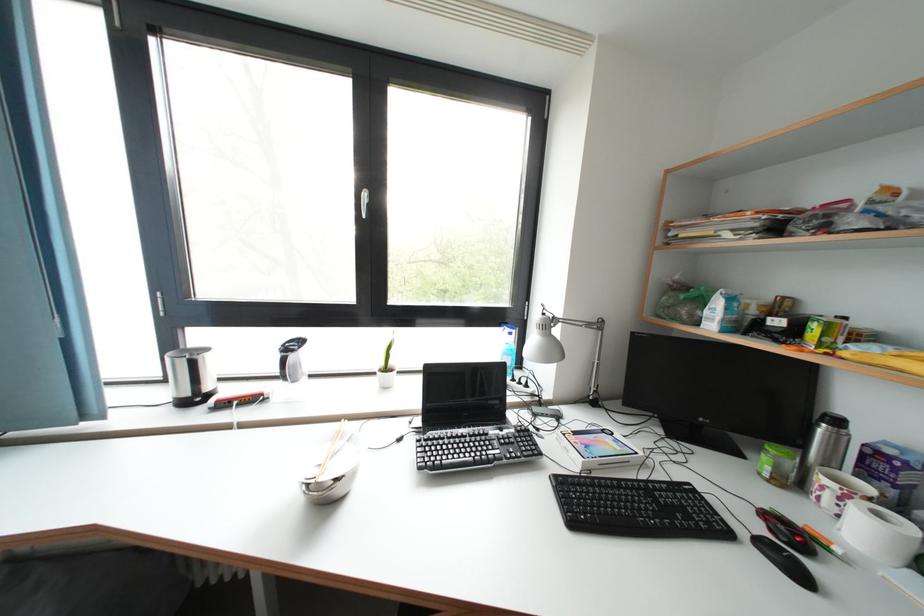
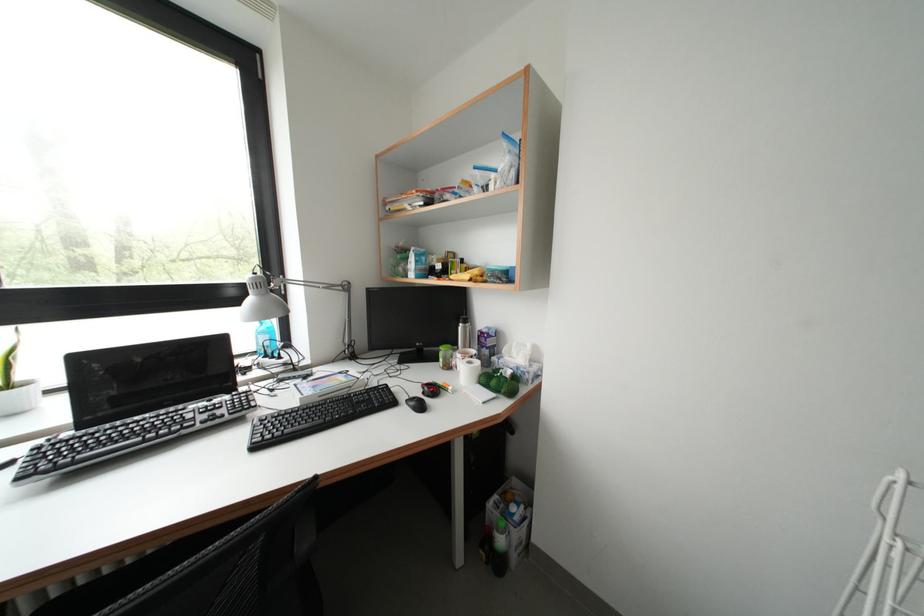
The point at (781, 560) is marked in the first image. Where is the corresponding point in the second image?

(419, 408)